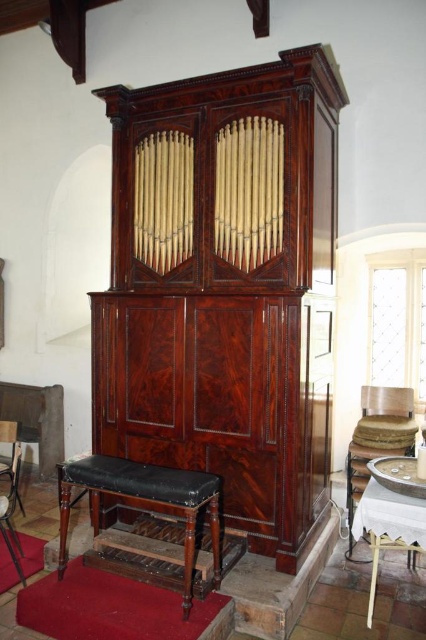
You are standing in a historical church and want to take a closer look at the mahogany wood pipe organ at center. If your maximum comfortable walking distance is 3 meters, can you comfortably reach the organ without straining?

The mahogany wood pipe organ at center is 3.32 meters away from the viewer, which exceeds your maximum comfortable walking distance of 3 meters. Therefore, you would need to walk an extra 0.32 meters beyond your comfort zone to reach it.

You are a musician who needs to sit on the smooth black leather bench at lower left while playing the mahogany wood pipe organ at center. Can you comfortably reach the organ from the bench?

The mahogany wood pipe organ at center is bigger than the smooth black leather bench at lower left, so yes, the musician can comfortably reach the organ from the bench since the bench is positioned close enough to the larger organ.

You are a musician preparing to play the organ and need to sit on one of the seats. You want to choose the seat that is closer to the organ pipes. Which one should you choose between the mahogany leather stool at lower left and the smooth black leather bench at lower left?

The mahogany leather stool at lower left is in front of the smooth black leather bench at lower left, so the mahogany leather stool at lower left is closer to the organ pipes.